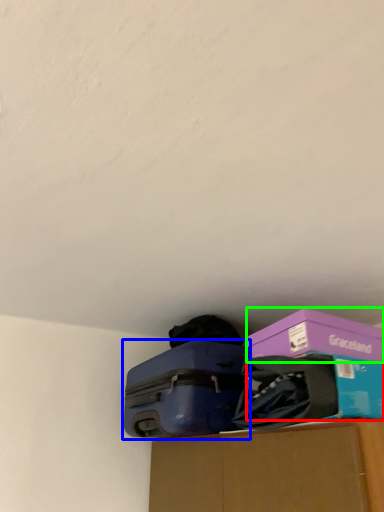
Question: Estimate the real-world distances between objects in this image. Which object is closer to storage box (highlighted by a red box), suitcase (highlighted by a blue box) or box (highlighted by a green box)?

Choices:
 (A) suitcase
 (B) box

Answer: (B)